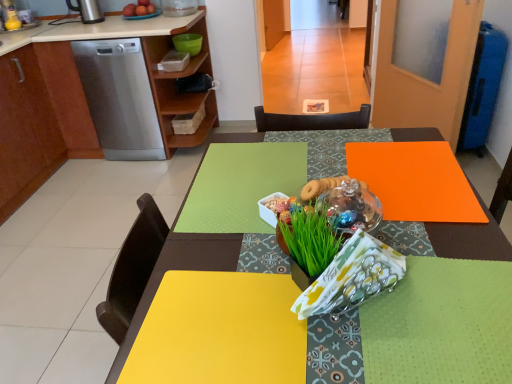
Where is `free space above green matte tablecloth at center (from a real-world perspective)`? Image resolution: width=512 pixels, height=384 pixels. free space above green matte tablecloth at center (from a real-world perspective) is located at coordinates (245, 179).